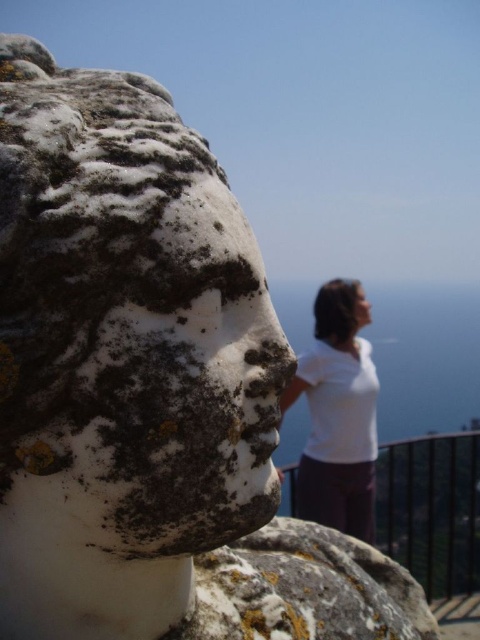
Based on the photo, does white matte shirt at upper center appear under blurred hair at upper center?

Correct, white matte shirt at upper center is located below blurred hair at upper center.

Can you confirm if white matte shirt at upper center is wider than blurred hair at upper center?

Indeed, white matte shirt at upper center has a greater width compared to blurred hair at upper center.

At what (x,y) coordinates should I click in order to perform the action: click on white matte shirt at upper center. Please return your answer as a coordinate pair (x, y). Looking at the image, I should click on (337, 413).

I want to click on white matte shirt at upper center, so click(337, 413).